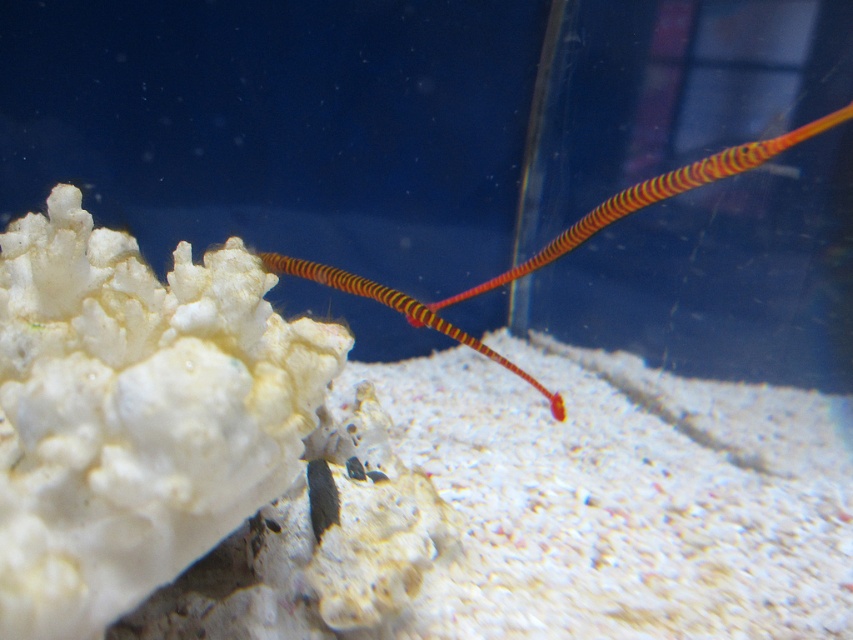
You are an aquatic biologist observing an aquarium. You notice the white porous coral at upper left and the orange striped pipefish at center. Which object is smaller in size?

The white porous coral at upper left is smaller in size compared to the orange striped pipefish at center.

You are an aquarium maintenance worker checking the tank layout. You need to place a new plant between the white porous coral at upper left and the orange striped pipefish at center. Can you determine which direction the plant should be placed relative to the coral?

The white porous coral at upper left is positioned under the orange striped pipefish at center, so the plant should be placed above the white porous coral at upper left to be between them.